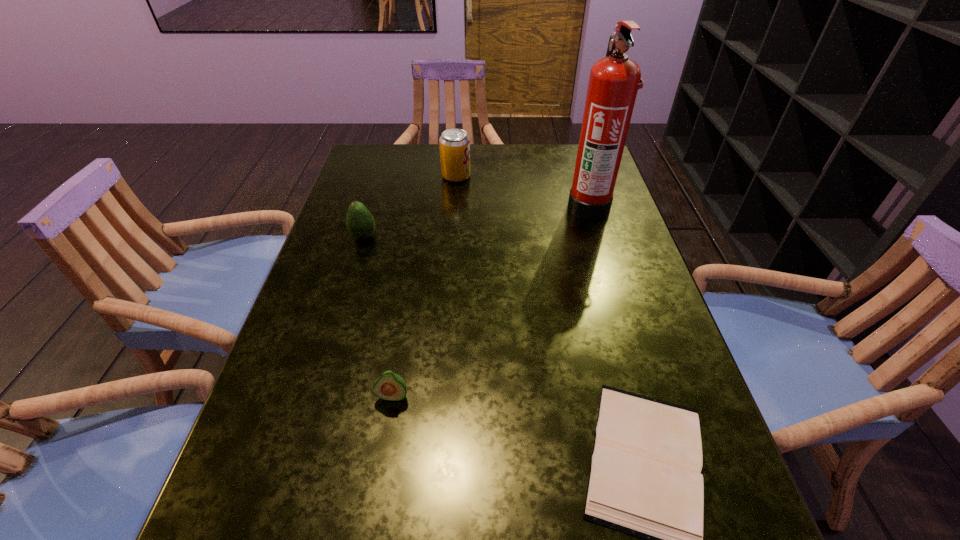
In the image, there is a desktop. Where is `free space at the far left corner`? free space at the far left corner is located at coordinates (382, 159).

Find the location of a particular element. This screenshot has height=540, width=960. blank space at the far right corner is located at coordinates (554, 152).

Identify the location of free space between the third nearest object and the fourth object from right to left. The image size is (960, 540). (378, 316).

Where is `empty space that is in between the second tallest object and the second object from left to right`? This screenshot has height=540, width=960. empty space that is in between the second tallest object and the second object from left to right is located at coordinates (424, 286).

The image size is (960, 540). Identify the location of empty location between the fourth nearest object and the shorter avocado. (491, 301).

At what (x,y) coordinates should I click in order to perform the action: click on free space between the farthest object and the third farthest object. Please return your answer as a coordinate pair (x, y). Looking at the image, I should click on (x=410, y=206).

Find the location of a particular element. The height and width of the screenshot is (540, 960). free space between the fourth nearest object and the farther avocado is located at coordinates (476, 221).

The height and width of the screenshot is (540, 960). In order to click on free space between the leftmost object and the fourth tallest object in this screenshot , I will do click(378, 316).

The height and width of the screenshot is (540, 960). I want to click on unoccupied area between the farthest object and the second shortest object, so click(x=424, y=286).

Identify which object is the second nearest to the shortest object. Please provide its 2D coordinates. Your answer should be formatted as a tuple, i.e. [(x, y)], where the tuple contains the x and y coordinates of a point satisfying the conditions above.

[(614, 80)]